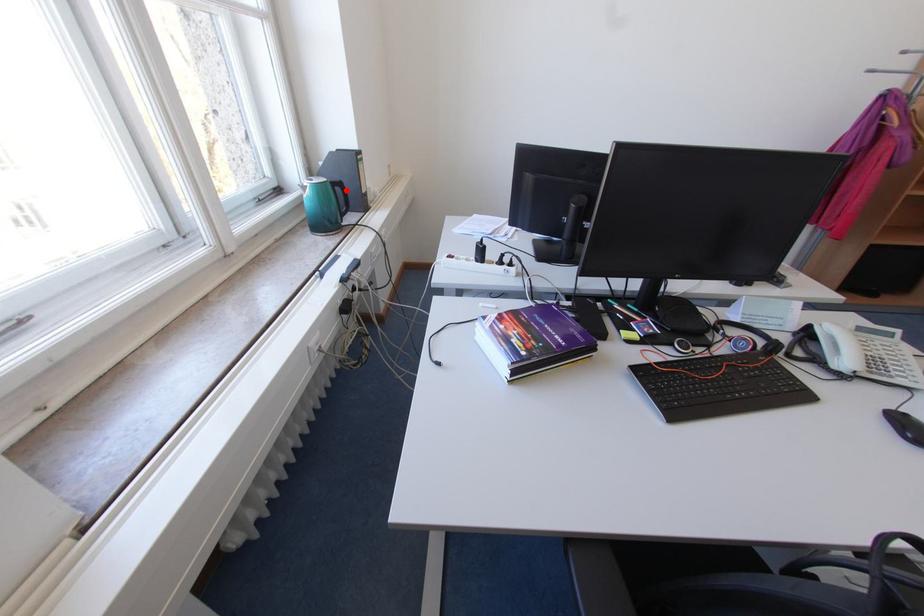
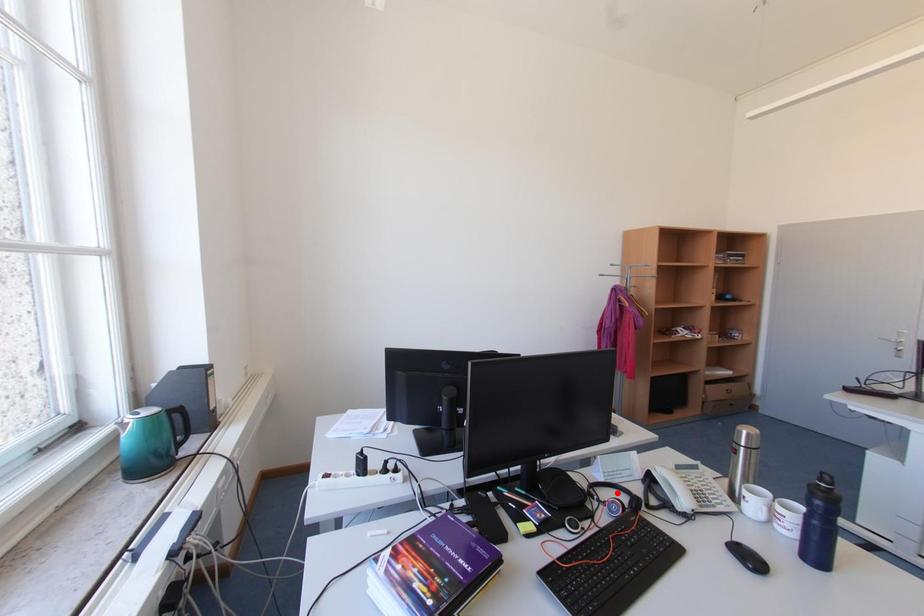
I am providing you with two images of the same scene from different viewpoints. A red point is marked on the first image and another point is marked on the second image. Does the point marked in image1 correspond to the same location as the one in image2?

No